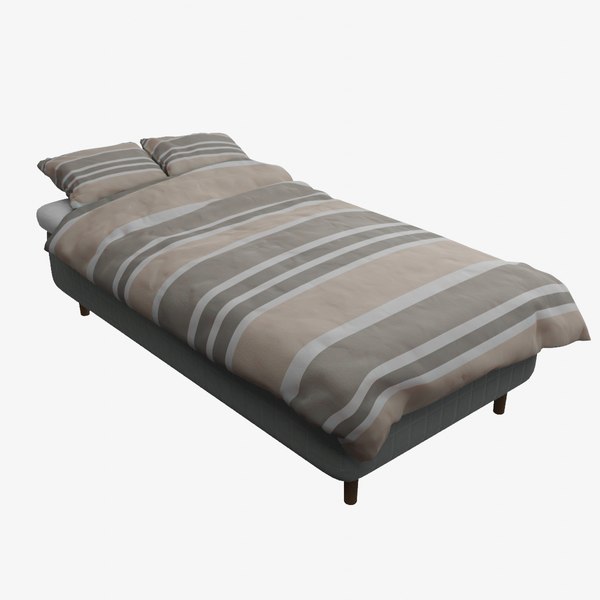
The height and width of the screenshot is (600, 600). Find the location of `bed`. bed is located at coordinates (246, 311).